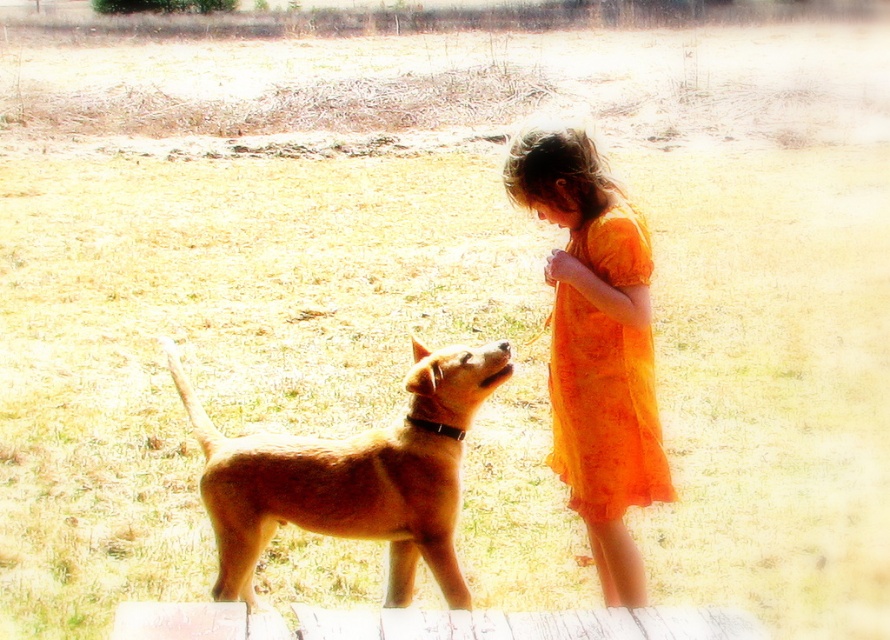
You are a photographer trying to capture a photo of the orange sheer dress at center and the orange sheer dress at upper right. Which dress should you focus on first to ensure both are in sharp focus?

You should focus on the orange sheer dress at center first because it is closer to the viewer than the orange sheer dress at upper right, so focusing on the closer one will help both be in focus.

You are standing in the field and want to locate the golden fur dog at center. According to the coordinates provided, where should you look?

You should look at point (352, 476) to find the golden fur dog at center.

You are a photographer trying to capture the girl in the orange sheer dress at center and the orange sheer dress at upper right in the same frame. Which dress should you focus on first to ensure both are in the frame?

You should focus on the orange sheer dress at center first because it is larger and more prominent in the scene, ensuring both dresses are captured in the frame.